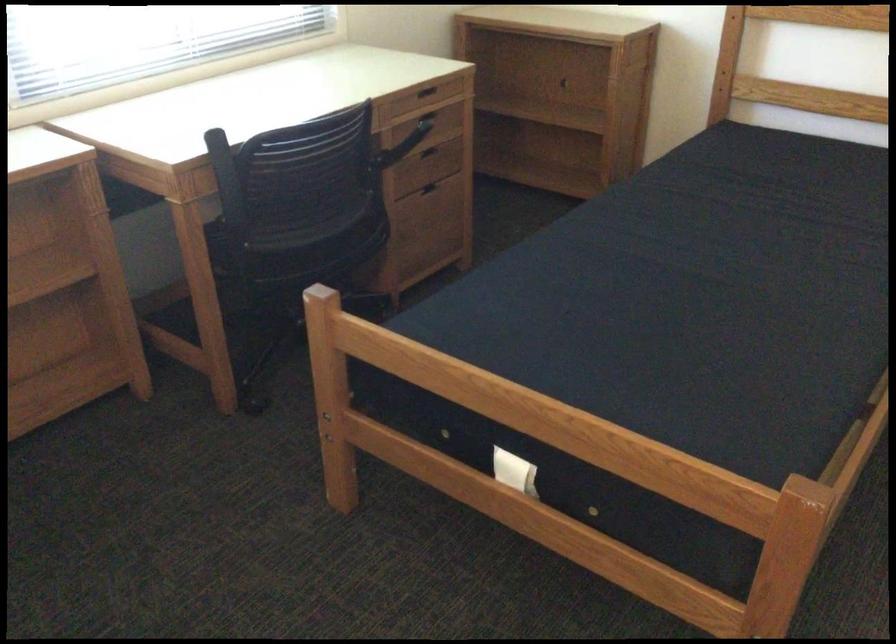
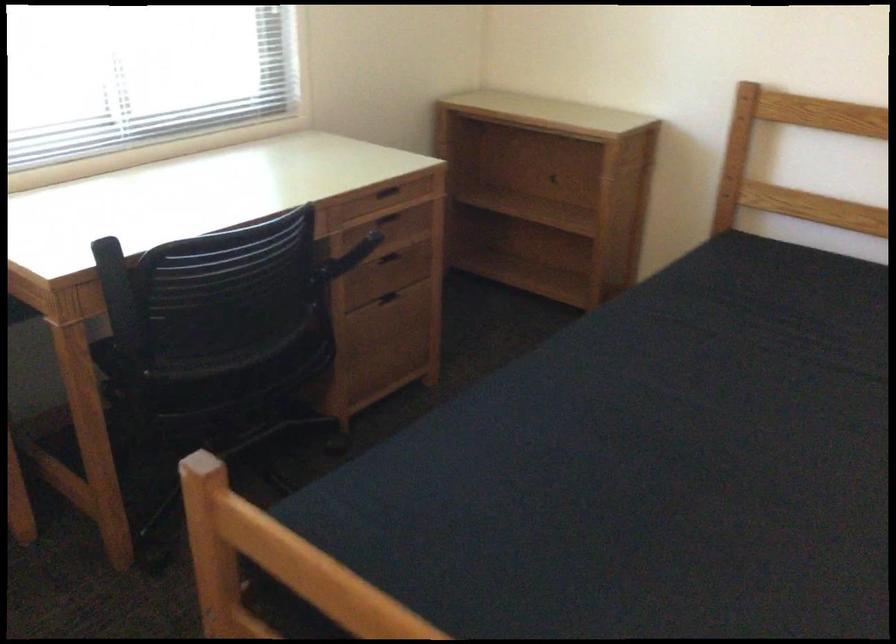
Question: The first image is from the beginning of the video and the second image is from the end. How did the camera likely rotate when shooting the video?

Choices:
 (A) Left
 (B) Right
 (C) Up
 (D) Down

Answer: (C)